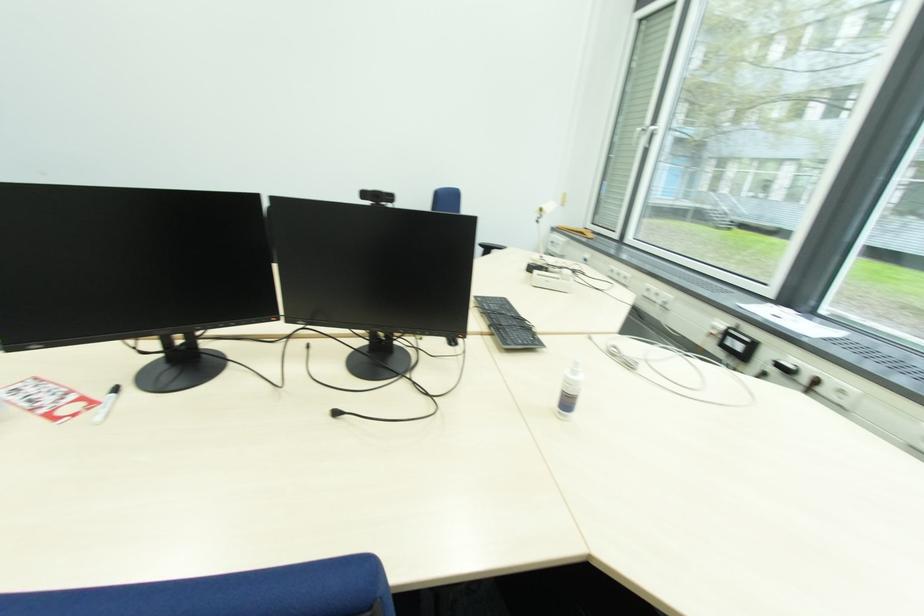
The height and width of the screenshot is (616, 924). I want to click on black wall switch, so click(x=737, y=344).